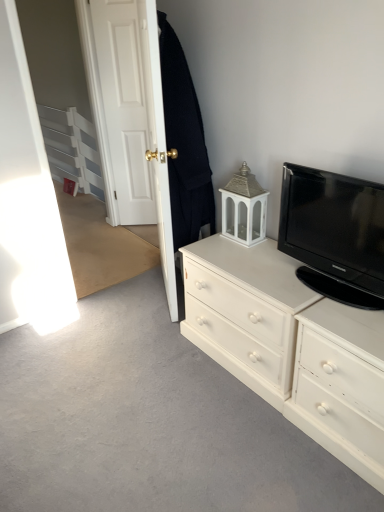
You are a GUI agent. You are given a task and a screenshot of the screen. Output one action in this format:
    pyautogui.click(x=<x>, y=<y>)
    Task: Click on the vacant space positioned to the left of white painted wood drawer at right
    The width and height of the screenshot is (384, 512).
    Given the screenshot: What is the action you would take?
    pyautogui.click(x=262, y=448)